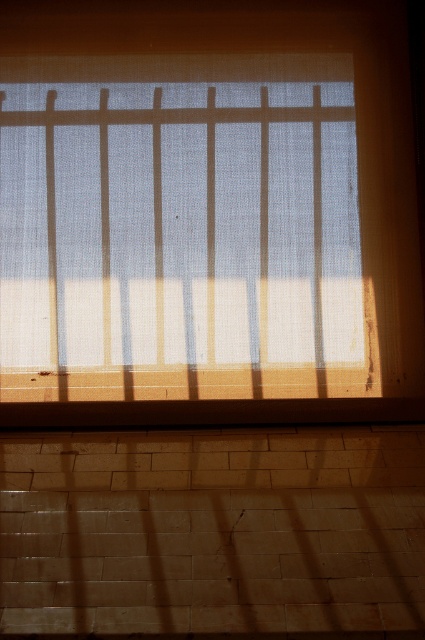
Does white sheer fabric at center appear under brown wood at bottom?

Incorrect, white sheer fabric at center is not positioned below brown wood at bottom.

Identify the location of white sheer fabric at center. (180, 228).

This screenshot has width=425, height=640. Describe the element at coordinates (180, 228) in the screenshot. I see `white sheer fabric at center` at that location.

Where is `white sheer fabric at center`? The width and height of the screenshot is (425, 640). white sheer fabric at center is located at coordinates (180, 228).